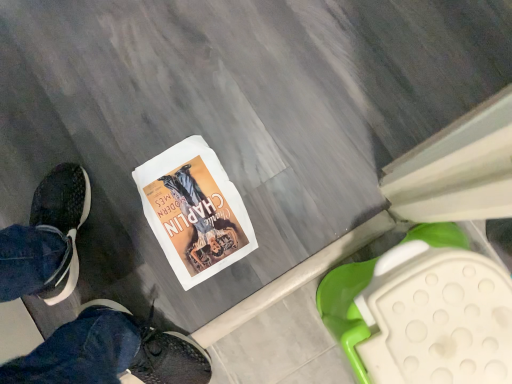
Identify the location of free space to the left of white paper comic book at center. (124, 263).